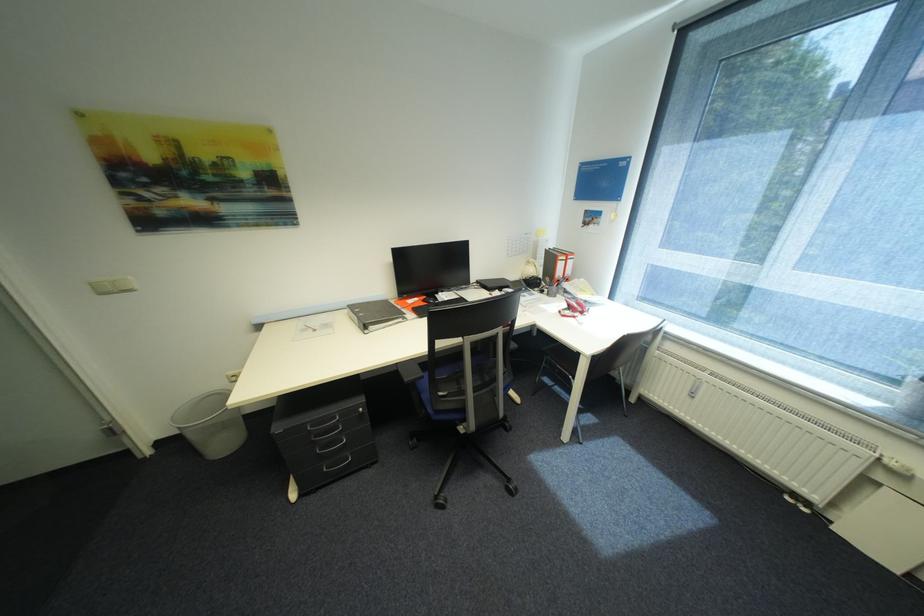
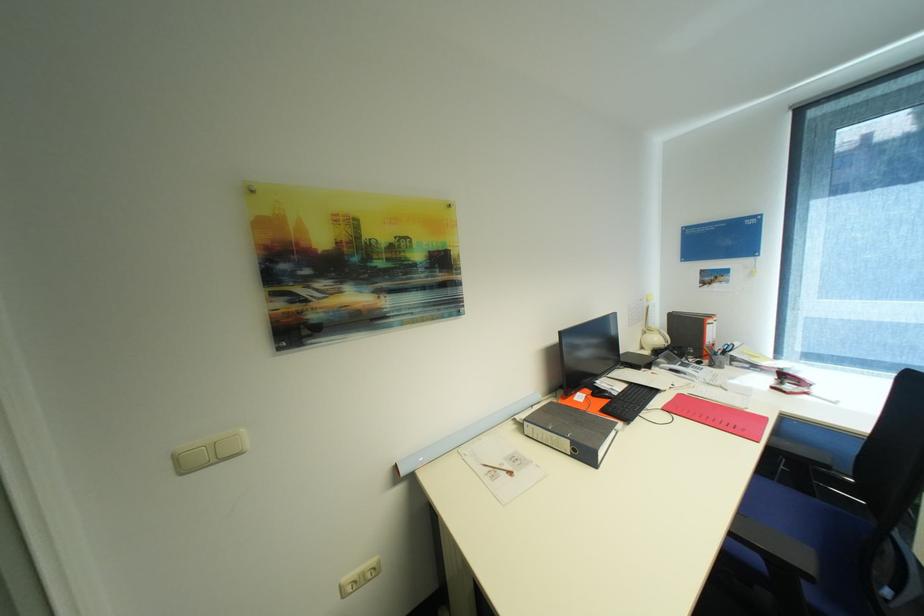
The images are taken continuously from a first-person perspective. In which direction are you moving?

The cameraman walked toward left, forward.